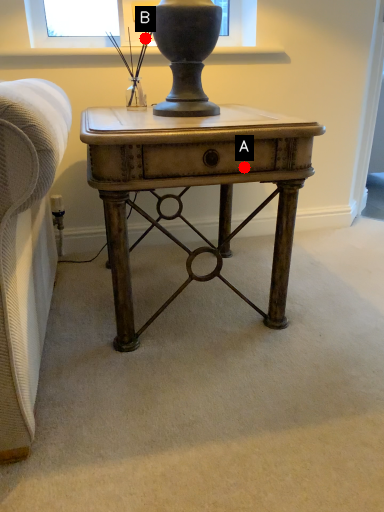
Question: Two points are circled on the image, labeled by A and B beside each circle. Which point appears farthest from the camera in this image?

Choices:
 (A) A is further
 (B) B is further

Answer: (B)